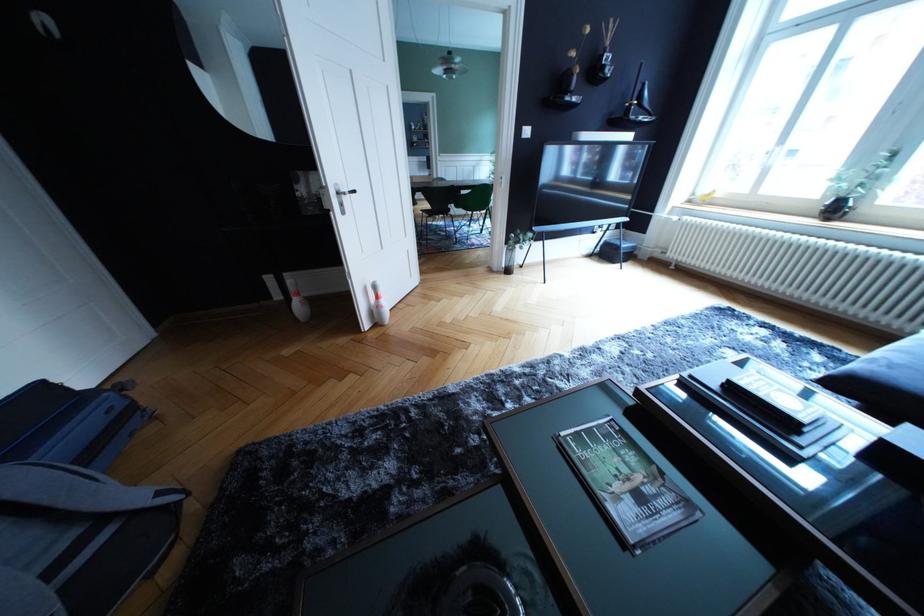
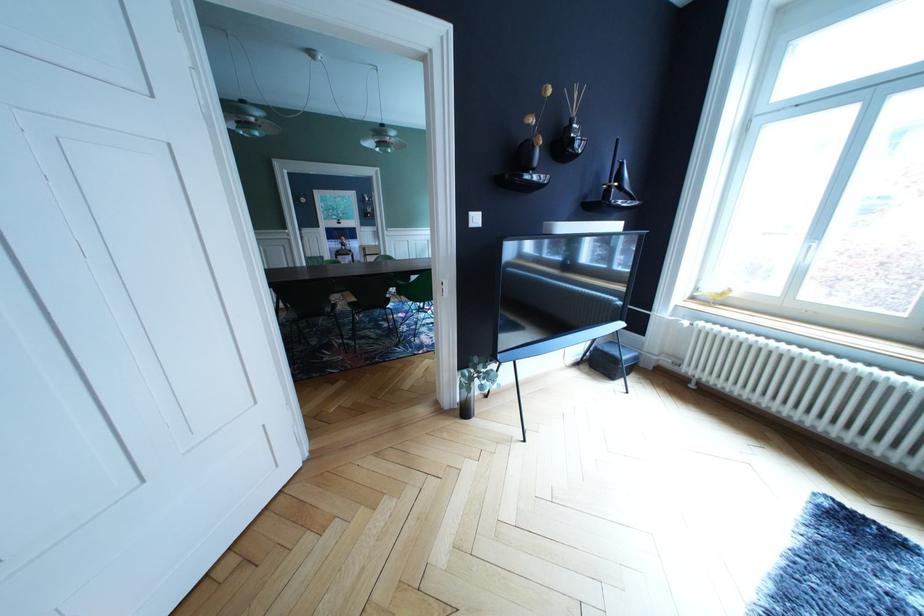
In the second image, find the point that corresponds to the point at 648,103 in the first image.

(628, 184)